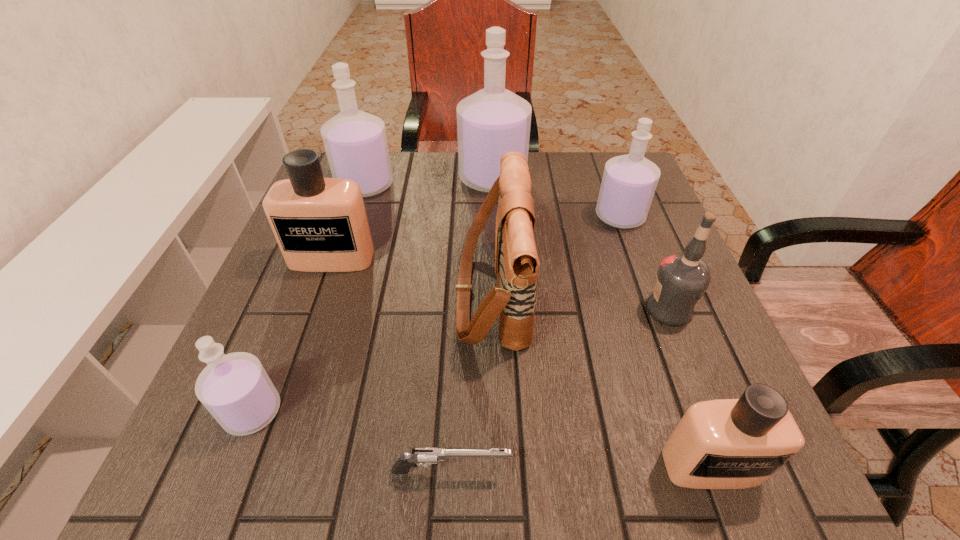
Locate an element on the screen. The height and width of the screenshot is (540, 960). the tallest perfume is located at coordinates (493, 121).

At what (x,y) coordinates should I click in order to perform the action: click on the second purple perfume from right to left. Please return your answer as a coordinate pair (x, y). This screenshot has height=540, width=960. Looking at the image, I should click on (493, 121).

The image size is (960, 540). I want to click on the second tallest perfume, so click(355, 142).

At what (x,y) coordinates should I click in order to perform the action: click on the third smallest purple perfume. Please return your answer as a coordinate pair (x, y). Image resolution: width=960 pixels, height=540 pixels. Looking at the image, I should click on (355, 142).

Identify the location of the rightmost purple perfume. (629, 182).

You are a GUI agent. You are given a task and a screenshot of the screen. Output one action in this format:
    pyautogui.click(x=<x>, y=<y>)
    Task: Click on the farther beige perfume
    The image size is (960, 540).
    Given the screenshot: What is the action you would take?
    click(320, 224)

Identify the location of the left beige perfume. The height and width of the screenshot is (540, 960). (320, 224).

You are a GUI agent. You are given a task and a screenshot of the screen. Output one action in this format:
    pyautogui.click(x=<x>, y=<y>)
    Task: Click on the shoulder bag
    The image size is (960, 540).
    Given the screenshot: What is the action you would take?
    pyautogui.click(x=513, y=301)

The width and height of the screenshot is (960, 540). In order to click on vodka in this screenshot , I will do `click(682, 279)`.

This screenshot has height=540, width=960. What are the coordinates of `the third nearest object` in the screenshot? It's located at (235, 388).